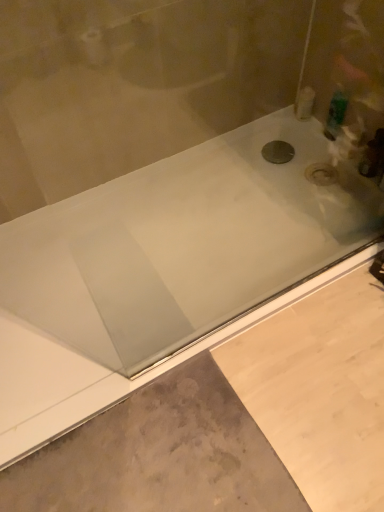
Locate an element on the screen. Image resolution: width=384 pixels, height=512 pixels. gray concrete at lower left is located at coordinates (159, 455).

The height and width of the screenshot is (512, 384). Identify the location of green plastic bottle at upper right, which is the first toiletry in right-to-left order. (336, 113).

Locate an element on the screen. This screenshot has width=384, height=512. white plastic bottle at upper right, arranged as the first toiletry when viewed from the left is located at coordinates (304, 103).

The height and width of the screenshot is (512, 384). Describe the element at coordinates (278, 152) in the screenshot. I see `black metallic drain at center` at that location.

Locate an element on the screen. Image resolution: width=384 pixels, height=512 pixels. gray concrete at lower left is located at coordinates (159, 455).

In terms of width, does gray concrete at lower left look wider or thinner when compared to green plastic bottle at upper right, which is the first toiletry in right-to-left order?

Clearly, gray concrete at lower left has more width compared to green plastic bottle at upper right, which is the first toiletry in right-to-left order.

From the image's perspective, is gray concrete at lower left located above green plastic bottle at upper right, which is the first toiletry in right-to-left order?

Actually, gray concrete at lower left appears below green plastic bottle at upper right, which is the first toiletry in right-to-left order, in the image.

Which is less distant, (94, 425) or (337, 118)?

The point (94, 425) is more forward.

Identify the location of concrete on the left side of white plastic bottle at upper right, arranged as the first toiletry when viewed from the left. (159, 455).

Which object is positioned more to the right, gray concrete at lower left or white plastic bottle at upper right, arranged as the second toiletry when viewed from the right?

Positioned to the right is white plastic bottle at upper right, arranged as the second toiletry when viewed from the right.

Is gray concrete at lower left wider than white plastic bottle at upper right, arranged as the second toiletry when viewed from the right?

Yes, gray concrete at lower left is wider than white plastic bottle at upper right, arranged as the second toiletry when viewed from the right.

Considering the positions of objects gray concrete at lower left and white plastic bottle at upper right, arranged as the second toiletry when viewed from the right, in the image provided, who is in front, gray concrete at lower left or white plastic bottle at upper right, arranged as the second toiletry when viewed from the right,?

gray concrete at lower left is closer to the camera.

Who is more distant, green plastic bottle at upper right, which is counted as the 2th toiletry, starting from the left, or gray concrete at lower left?

green plastic bottle at upper right, which is counted as the 2th toiletry, starting from the left, is further away from the camera.

Is green plastic bottle at upper right, which is the first toiletry in right-to-left order, not within gray concrete at lower left?

Yes, green plastic bottle at upper right, which is the first toiletry in right-to-left order, is outside of gray concrete at lower left.

Which of these two, green plastic bottle at upper right, which is the first toiletry in right-to-left order, or gray concrete at lower left, stands taller?

With more height is green plastic bottle at upper right, which is the first toiletry in right-to-left order.

In terms of width, does green plastic bottle at upper right, which is the first toiletry in right-to-left order, look wider or thinner when compared to gray concrete at lower left?

green plastic bottle at upper right, which is the first toiletry in right-to-left order, is thinner than gray concrete at lower left.

Does green plastic bottle at upper right, which is counted as the 2th toiletry, starting from the left, have a smaller size compared to black metallic drain at center?

No, green plastic bottle at upper right, which is counted as the 2th toiletry, starting from the left, is not smaller than black metallic drain at center.

From a real-world perspective, relative to black metallic drain at center, is green plastic bottle at upper right, which is the first toiletry in right-to-left order, vertically above or below?

Clearly, from a real-world perspective, green plastic bottle at upper right, which is the first toiletry in right-to-left order, is above black metallic drain at center.

From the image's perspective, is green plastic bottle at upper right, which is the first toiletry in right-to-left order, located above or below black metallic drain at center?

From the image's perspective, green plastic bottle at upper right, which is the first toiletry in right-to-left order, appears above black metallic drain at center.

Is point (279, 149) positioned after point (336, 136)?

Yes.

Can you confirm if black metallic drain at center is wider than green plastic bottle at upper right, which is the first toiletry in right-to-left order?

Yes.

From a real-world perspective, count 2nd toiletrys upward from the black metallic drain at center and point to it. Please provide its 2D coordinates.

[(336, 113)]

Measure the distance between black metallic drain at center and green plastic bottle at upper right, which is counted as the 2th toiletry, starting from the left.

black metallic drain at center and green plastic bottle at upper right, which is counted as the 2th toiletry, starting from the left, are 7.72 inches apart from each other.

Considering the sizes of objects black metallic drain at center and gray concrete at lower left in the image provided, who is thinner, black metallic drain at center or gray concrete at lower left?

Thinner between the two is black metallic drain at center.

From the image's perspective, which object appears higher, black metallic drain at center or gray concrete at lower left?

black metallic drain at center.

Is black metallic drain at center looking in the opposite direction of gray concrete at lower left?

black metallic drain at center is not turned away from gray concrete at lower left.

Is the position of black metallic drain at center more distant than that of white plastic bottle at upper right, arranged as the first toiletry when viewed from the left?

No, black metallic drain at center is closer to the camera.

From the picture: From a real-world perspective, is black metallic drain at center located higher than white plastic bottle at upper right, arranged as the first toiletry when viewed from the left?

Actually, black metallic drain at center is physically below white plastic bottle at upper right, arranged as the first toiletry when viewed from the left, in the real world.

Is black metallic drain at center positioned far away from white plastic bottle at upper right, arranged as the first toiletry when viewed from the left?

No, black metallic drain at center is not far away from white plastic bottle at upper right, arranged as the first toiletry when viewed from the left.

From the image's perspective, who appears lower, black metallic drain at center or white plastic bottle at upper right, arranged as the first toiletry when viewed from the left?

From the image's view, black metallic drain at center is below.

Where is `concrete in front of the green plastic bottle at upper right, which is the first toiletry in right-to-left order`? concrete in front of the green plastic bottle at upper right, which is the first toiletry in right-to-left order is located at coordinates (159, 455).

Where is `the 1st toiletry directly above the gray concrete at lower left (from a real-world perspective)`? the 1st toiletry directly above the gray concrete at lower left (from a real-world perspective) is located at coordinates (304, 103).

Which object lies further to the anchor point white plastic bottle at upper right, arranged as the second toiletry when viewed from the right, black metallic drain at center or green plastic bottle at upper right, which is counted as the 2th toiletry, starting from the left?

The object further to white plastic bottle at upper right, arranged as the second toiletry when viewed from the right, is black metallic drain at center.

Estimate the real-world distances between objects in this image. Which object is closer to green plastic bottle at upper right, which is counted as the 2th toiletry, starting from the left, black metallic drain at center or gray concrete at lower left?

black metallic drain at center lies closer to green plastic bottle at upper right, which is counted as the 2th toiletry, starting from the left, than the other object.

Which object lies further to the anchor point white plastic bottle at upper right, arranged as the first toiletry when viewed from the left, green plastic bottle at upper right, which is counted as the 2th toiletry, starting from the left, or gray concrete at lower left?

gray concrete at lower left is positioned further to the anchor white plastic bottle at upper right, arranged as the first toiletry when viewed from the left.

From the image, which object appears to be farther from black metallic drain at center, gray concrete at lower left or white plastic bottle at upper right, arranged as the second toiletry when viewed from the right?

Based on the image, gray concrete at lower left appears to be further to black metallic drain at center.

Estimate the real-world distances between objects in this image. Which object is further from gray concrete at lower left, white plastic bottle at upper right, arranged as the second toiletry when viewed from the right, or green plastic bottle at upper right, which is the first toiletry in right-to-left order?

white plastic bottle at upper right, arranged as the second toiletry when viewed from the right, lies further to gray concrete at lower left than the other object.

Estimate the real-world distances between objects in this image. Which object is further from black metallic drain at center, green plastic bottle at upper right, which is counted as the 2th toiletry, starting from the left, or gray concrete at lower left?

gray concrete at lower left.

Looking at the image, which one is located closer to gray concrete at lower left, white plastic bottle at upper right, arranged as the second toiletry when viewed from the right, or black metallic drain at center?

The object closer to gray concrete at lower left is black metallic drain at center.

When comparing their distances from gray concrete at lower left, does green plastic bottle at upper right, which is the first toiletry in right-to-left order, or black metallic drain at center seem closer?

Among the two, black metallic drain at center is located nearer to gray concrete at lower left.

Find the location of a particular element. toiletry between white plastic bottle at upper right, arranged as the second toiletry when viewed from the right, and gray concrete at lower left, in the vertical direction is located at coordinates (336, 113).

I want to click on drain that lies between white plastic bottle at upper right, arranged as the second toiletry when viewed from the right, and gray concrete at lower left from top to bottom, so click(x=278, y=152).

At what (x,y) coordinates should I click in order to perform the action: click on toiletry between white plastic bottle at upper right, arranged as the first toiletry when viewed from the left, and black metallic drain at center, in the vertical direction. Please return your answer as a coordinate pair (x, y). Image resolution: width=384 pixels, height=512 pixels. Looking at the image, I should click on (336, 113).

Identify the location of drain between green plastic bottle at upper right, which is counted as the 2th toiletry, starting from the left, and gray concrete at lower left in the up-down direction. The width and height of the screenshot is (384, 512). (278, 152).